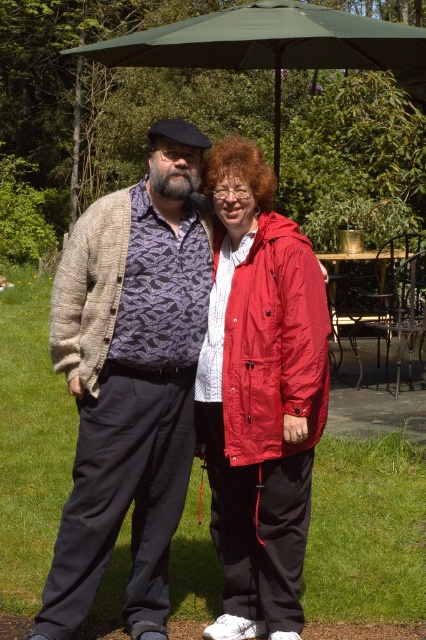
Question: Among these points, which one is farthest from the camera?

Choices:
 (A) coord(212,477)
 (B) coord(368,51)
 (C) coord(373,285)

Answer: (C)

Question: Is matte red jacket at center thinner than green fabric umbrella at upper center?

Choices:
 (A) yes
 (B) no

Answer: (A)

Question: Which point is farther to the camera?

Choices:
 (A) matte red jacket at center
 (B) metallic wrought iron picnic table at center

Answer: (B)

Question: Which point is closer to the camera taking this photo?

Choices:
 (A) (209, 35)
 (B) (141, 332)

Answer: (B)

Question: In this image, where is matte red jacket at center located relative to green fabric umbrella at upper center?

Choices:
 (A) above
 (B) below

Answer: (B)

Question: Is matte red jacket at center to the left of green fabric umbrella at upper center from the viewer's perspective?

Choices:
 (A) yes
 (B) no

Answer: (B)